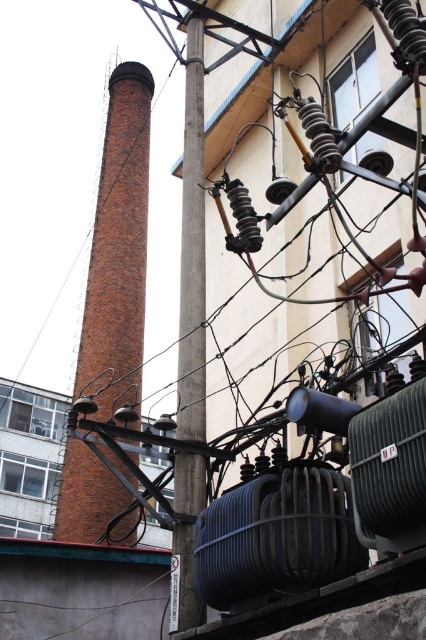
You are a city planner assessing the urban space. You need to determine if the red brick chimney at left and the smooth gray pole at center can both fit within a designated maintenance zone that can accommodate objects up to the size of the larger one. Which object determines the minimum required size of the maintenance zone?

The red brick chimney at left is larger in size than the smooth gray pole at center, so the maintenance zone must be sized to accommodate the red brick chimney at left.

You are standing in front of the utility pole and the chimney. You notice two points marked on the image. Which point is closer to you, point (137, 140) or point (178, 468)?

Point (137, 140) is closer to you than point (178, 468) because it is further to the viewer.

You are a city planner assessing the urban landscape. You notice the red brick chimney at left and the smooth gray pole at center. Based on their positions and sizes, which structure would cast a longer shadow during midday when the sun is directly overhead?

The red brick chimney at left has a greater height compared to the smooth gray pole at center, so it would cast a longer shadow during midday when the sun is directly overhead.